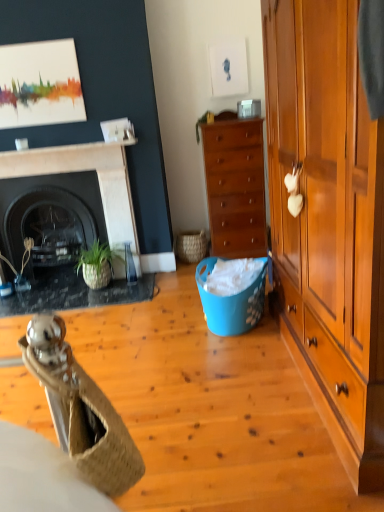
Question: From a real-world perspective, is woven straw chair at lower left below blue plastic laundry basket at center?

Choices:
 (A) yes
 (B) no

Answer: (B)

Question: Is woven straw chair at lower left far away from blue plastic laundry basket at center?

Choices:
 (A) no
 (B) yes

Answer: (B)

Question: Does woven straw chair at lower left appear on the left side of blue plastic laundry basket at center?

Choices:
 (A) yes
 (B) no

Answer: (A)

Question: Does woven straw chair at lower left have a lesser height compared to blue plastic laundry basket at center?

Choices:
 (A) no
 (B) yes

Answer: (B)

Question: Considering the relative sizes of woven straw chair at lower left and blue plastic laundry basket at center in the image provided, is woven straw chair at lower left bigger than blue plastic laundry basket at center?

Choices:
 (A) no
 (B) yes

Answer: (A)

Question: From the image's perspective, is satin silver phone at upper center located above or below black marble fireplace at left, the second fireplace from the back?

Choices:
 (A) above
 (B) below

Answer: (A)

Question: Is point (248, 101) closer or farther from the camera than point (117, 185)?

Choices:
 (A) farther
 (B) closer

Answer: (B)

Question: Considering the positions of satin silver phone at upper center and black marble fireplace at left, the second fireplace from the back, in the image, is satin silver phone at upper center bigger or smaller than black marble fireplace at left, the second fireplace from the back,?

Choices:
 (A) small
 (B) big

Answer: (A)

Question: Relative to black marble fireplace at left, the second fireplace from the back, is satin silver phone at upper center in front or behind?

Choices:
 (A) front
 (B) behind

Answer: (B)

Question: In the image, is satin silver phone at upper center on the left side or the right side of black glossy fireplace at left, acting as the first fireplace starting from the back?

Choices:
 (A) right
 (B) left

Answer: (A)

Question: From a real-world perspective, is satin silver phone at upper center physically located above or below black glossy fireplace at left, acting as the first fireplace starting from the back?

Choices:
 (A) above
 (B) below

Answer: (A)

Question: In terms of height, does satin silver phone at upper center look taller or shorter compared to black glossy fireplace at left, acting as the first fireplace starting from the back?

Choices:
 (A) short
 (B) tall

Answer: (A)

Question: Does point (253, 106) appear closer or farther from the camera than point (3, 218)?

Choices:
 (A) closer
 (B) farther

Answer: (A)

Question: Is wooden cabinet at right inside the boundaries of satin silver phone at upper center, or outside?

Choices:
 (A) inside
 (B) outside

Answer: (B)

Question: From a real-world perspective, is wooden cabinet at right positioned above or below satin silver phone at upper center?

Choices:
 (A) below
 (B) above

Answer: (A)